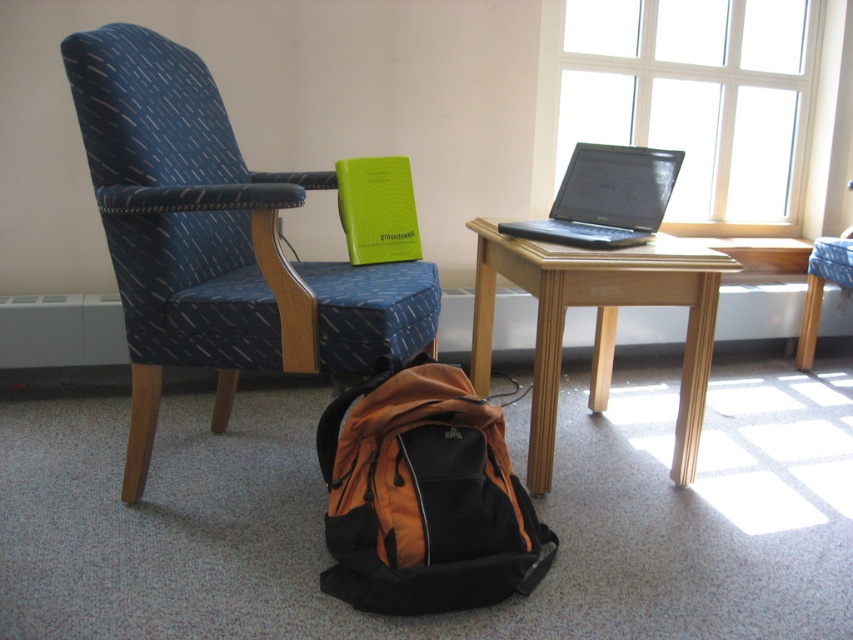
Question: Can you confirm if orange fabric backpack at lower center is positioned to the left of wooden table at center?

Choices:
 (A) no
 (B) yes

Answer: (B)

Question: Which point is closer to the camera?

Choices:
 (A) (675, 305)
 (B) (819, 276)

Answer: (A)

Question: Is wooden table at center positioned behind blue fabric stool at lower right?

Choices:
 (A) yes
 (B) no

Answer: (B)

Question: Does orange fabric backpack at lower center appear under blue fabric stool at lower right?

Choices:
 (A) no
 (B) yes

Answer: (B)

Question: Which object is the closest to the blue fabric armchair at left?

Choices:
 (A) blue fabric stool at lower right
 (B) black glossy laptop at center
 (C) orange fabric backpack at lower center

Answer: (C)

Question: Which point is farther to the camera?

Choices:
 (A) wooden table at center
 (B) orange fabric backpack at lower center

Answer: (A)